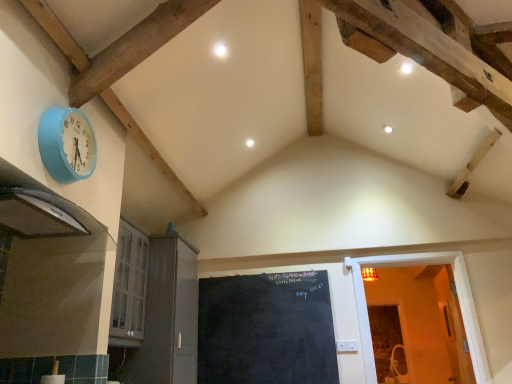
Question: Should I look upward or downward to see black glossy exhaust hood at left?

Choices:
 (A) up
 (B) down

Answer: (B)

Question: Can you confirm if black chalkboard at center is taller than black glossy exhaust hood at left?

Choices:
 (A) no
 (B) yes

Answer: (B)

Question: Does black chalkboard at center come behind black glossy exhaust hood at left?

Choices:
 (A) yes
 (B) no

Answer: (A)

Question: Is black glossy exhaust hood at left completely or partially inside black chalkboard at center?

Choices:
 (A) yes
 (B) no

Answer: (B)

Question: Does black chalkboard at center have a lesser height compared to black glossy exhaust hood at left?

Choices:
 (A) no
 (B) yes

Answer: (A)

Question: Is black chalkboard at center thinner than black glossy exhaust hood at left?

Choices:
 (A) no
 (B) yes

Answer: (B)

Question: Is black chalkboard at center outside of black glossy exhaust hood at left?

Choices:
 (A) yes
 (B) no

Answer: (A)

Question: From the image's perspective, is black chalkboard at center beneath white glossy cabinet at lower left, positioned as the first door in left-to-right order?

Choices:
 (A) yes
 (B) no

Answer: (A)

Question: Is black chalkboard at center outside white glossy cabinet at lower left, placed as the second door when sorted from right to left?

Choices:
 (A) no
 (B) yes

Answer: (B)

Question: Is black chalkboard at center directly adjacent to white glossy cabinet at lower left, placed as the second door when sorted from right to left?

Choices:
 (A) no
 (B) yes

Answer: (A)

Question: Does black chalkboard at center have a lesser height compared to white glossy cabinet at lower left, positioned as the first door in left-to-right order?

Choices:
 (A) no
 (B) yes

Answer: (B)

Question: From a real-world perspective, does black chalkboard at center stand above white glossy cabinet at lower left, positioned as the first door in left-to-right order?

Choices:
 (A) yes
 (B) no

Answer: (B)

Question: Is black chalkboard at center in front of white glossy cabinet at lower left, placed as the second door when sorted from right to left?

Choices:
 (A) no
 (B) yes

Answer: (A)

Question: Is wooden door at right, arranged as the first door when viewed from the right, positioned before blue fabric wall clock at upper left?

Choices:
 (A) no
 (B) yes

Answer: (A)